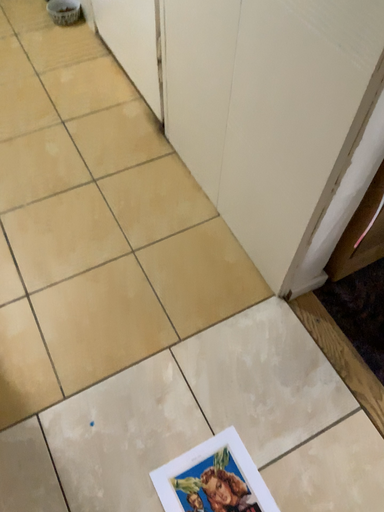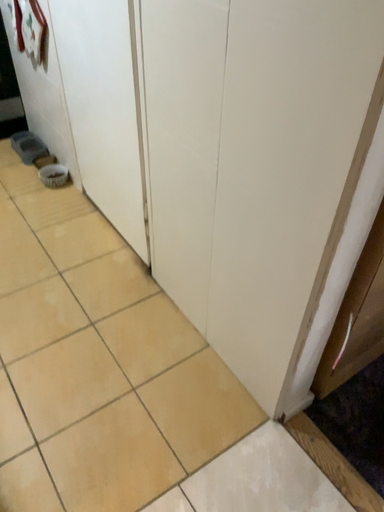
Question: How did the camera likely rotate when shooting the video?

Choices:
 (A) rotated upward
 (B) rotated downward

Answer: (A)